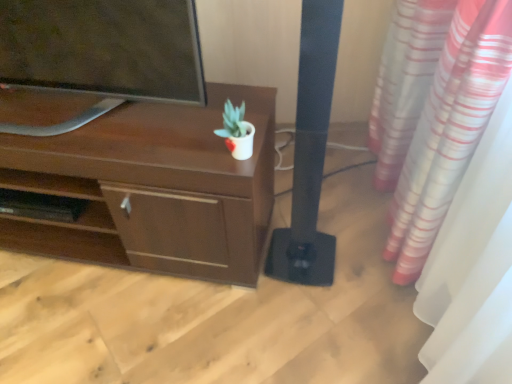
Question: Is point (318, 127) positioned closer to the camera than point (64, 137)?

Choices:
 (A) closer
 (B) farther

Answer: (A)

Question: Is black matte speaker at center wider or thinner than brown matte desk at upper left?

Choices:
 (A) thin
 (B) wide

Answer: (A)

Question: Which is nearer to the brown matte desk at upper left?

Choices:
 (A) black matte speaker at center
 (B) matte black tv at upper left
 (C) white glossy pot at center

Answer: (B)

Question: Based on their relative distances, which object is nearer to the white glossy pot at center?

Choices:
 (A) black matte speaker at center
 (B) brown matte desk at upper left
 (C) matte black tv at upper left

Answer: (A)